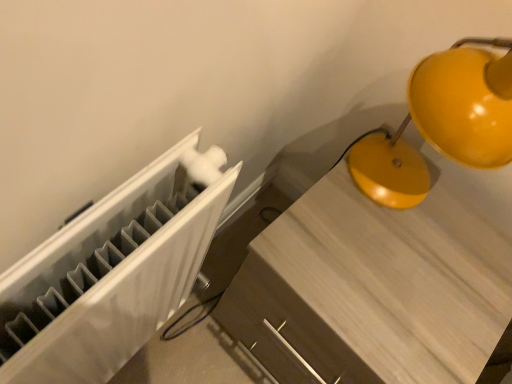
Question: Considering the relative sizes of matte yellow lamp at upper right and matte wood table at center in the image provided, is matte yellow lamp at upper right smaller than matte wood table at center?

Choices:
 (A) yes
 (B) no

Answer: (A)

Question: Are matte yellow lamp at upper right and matte wood table at center located far from each other?

Choices:
 (A) no
 (B) yes

Answer: (A)

Question: Is matte yellow lamp at upper right facing away from matte wood table at center?

Choices:
 (A) yes
 (B) no

Answer: (B)

Question: Does matte yellow lamp at upper right lie behind matte wood table at center?

Choices:
 (A) yes
 (B) no

Answer: (B)

Question: Does matte yellow lamp at upper right appear on the left side of matte wood table at center?

Choices:
 (A) yes
 (B) no

Answer: (B)

Question: Does matte yellow lamp at upper right have a lesser width compared to matte wood table at center?

Choices:
 (A) yes
 (B) no

Answer: (A)

Question: Would you say matte wood table at center is a long distance from matte yellow lamp at upper right?

Choices:
 (A) yes
 (B) no

Answer: (B)

Question: From a real-world perspective, is matte wood table at center located beneath matte yellow lamp at upper right?

Choices:
 (A) no
 (B) yes

Answer: (B)

Question: Is matte wood table at center facing away from matte yellow lamp at upper right?

Choices:
 (A) no
 (B) yes

Answer: (A)

Question: From a real-world perspective, is matte wood table at center on matte yellow lamp at upper right?

Choices:
 (A) no
 (B) yes

Answer: (A)

Question: Is matte wood table at center to the right of matte yellow lamp at upper right from the viewer's perspective?

Choices:
 (A) no
 (B) yes

Answer: (A)

Question: Is matte wood table at center taller than matte yellow lamp at upper right?

Choices:
 (A) yes
 (B) no

Answer: (A)

Question: Considering the relative positions of matte yellow lamp at upper right and matte wood table at center in the image provided, is matte yellow lamp at upper right to the left or to the right of matte wood table at center?

Choices:
 (A) right
 (B) left

Answer: (A)